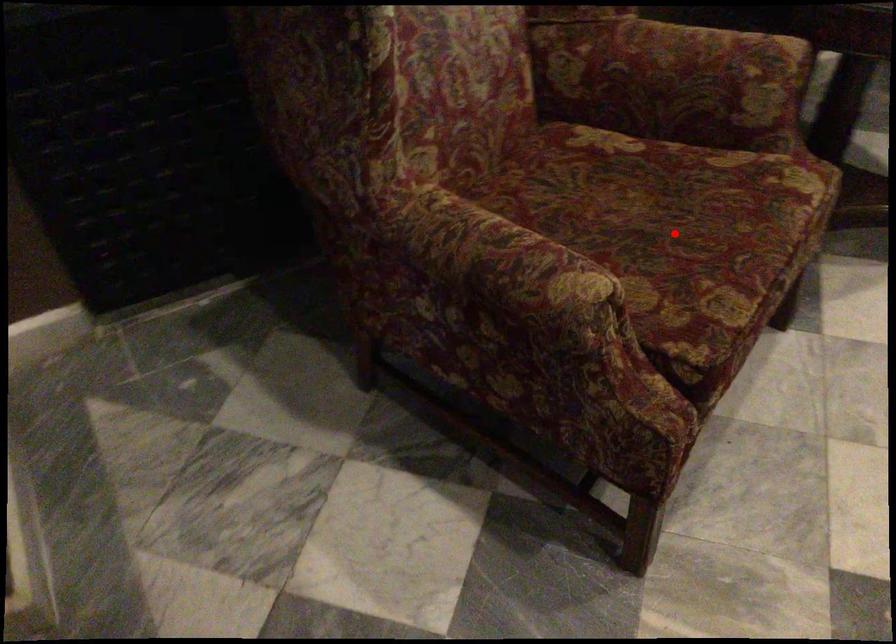
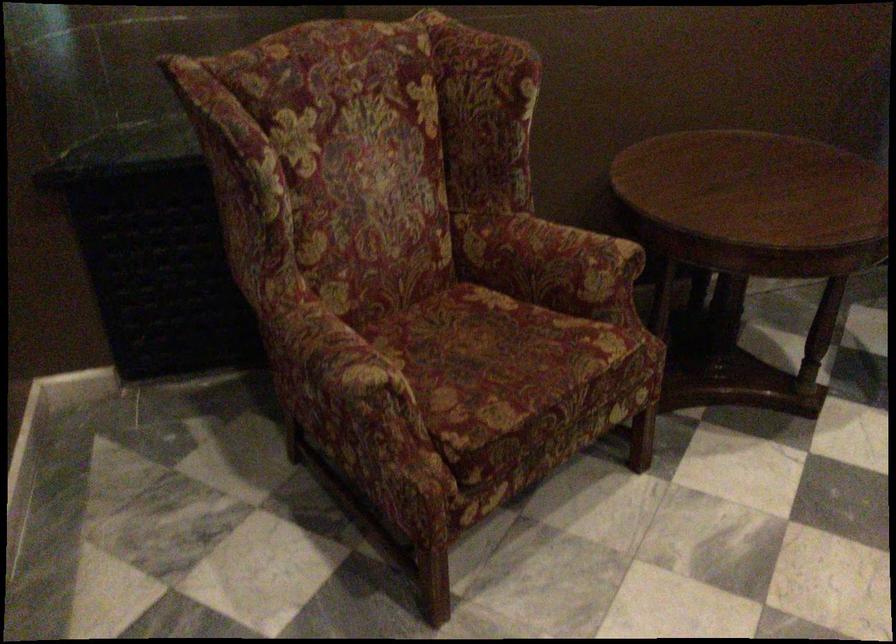
Question: I am providing you with two images of the same scene from different viewpoints. A red point is shown in image1. For the corresponding object point in image2, is it positioned nearer or farther from the camera?

Choices:
 (A) Nearer
 (B) Farther

Answer: (B)